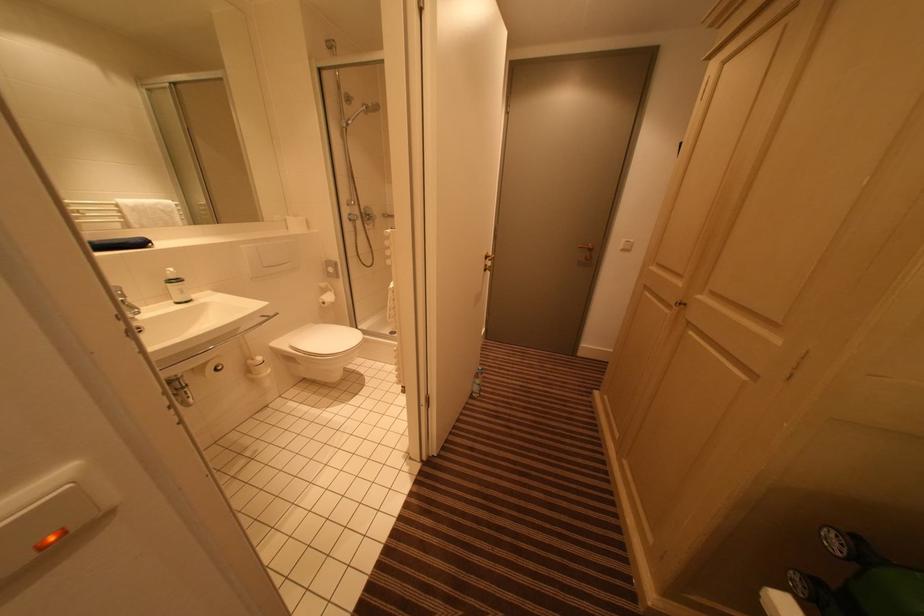
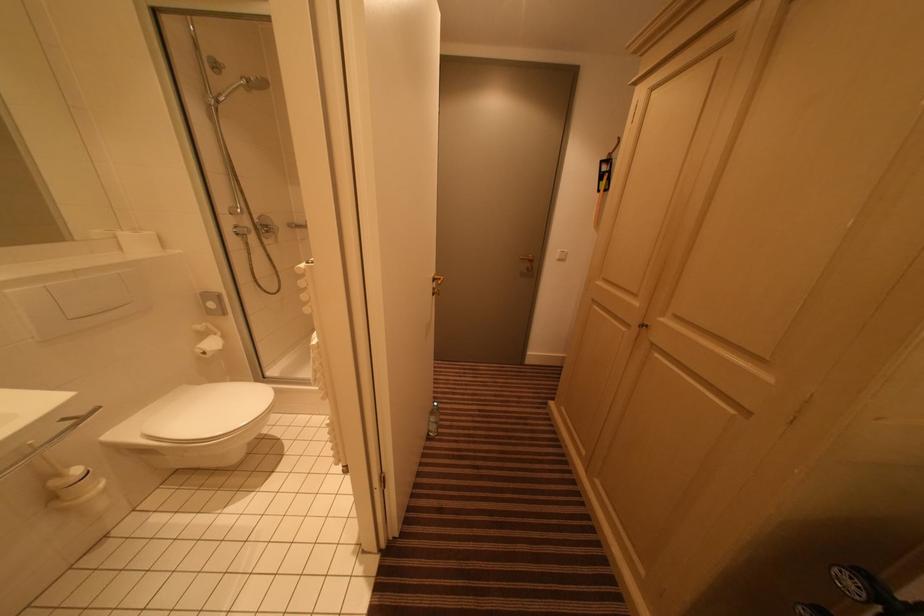
Question: The images are taken continuously from a first-person perspective. In which direction are you moving?

Choices:
 (A) Left
 (B) Right
 (C) Forward
 (D) Backward

Answer: (C)